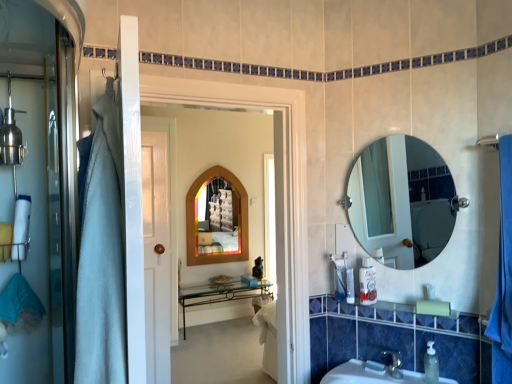
Image resolution: width=512 pixels, height=384 pixels. I want to click on free location above clear glass mirror at upper right, the 2th mirror viewed from the left (from a real-world perspective), so click(400, 127).